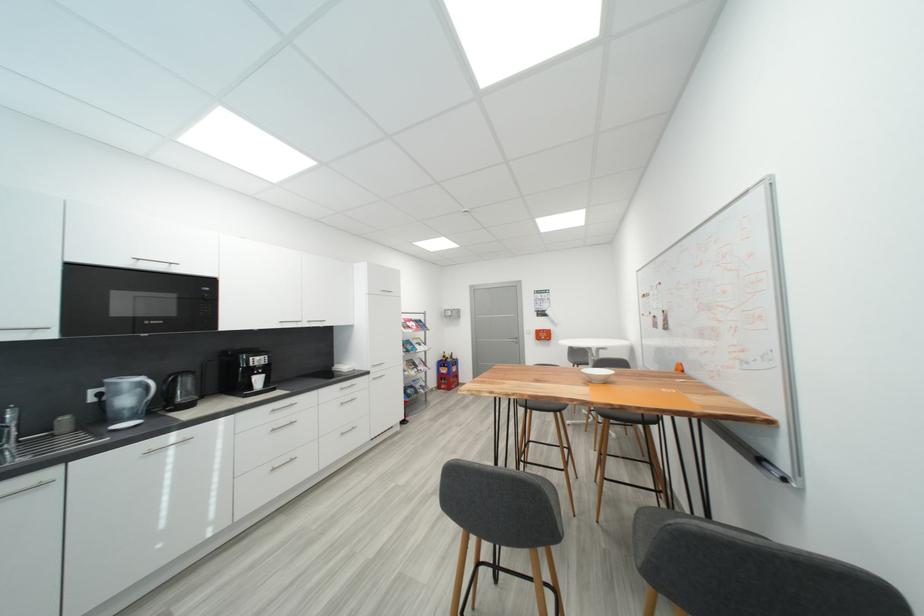
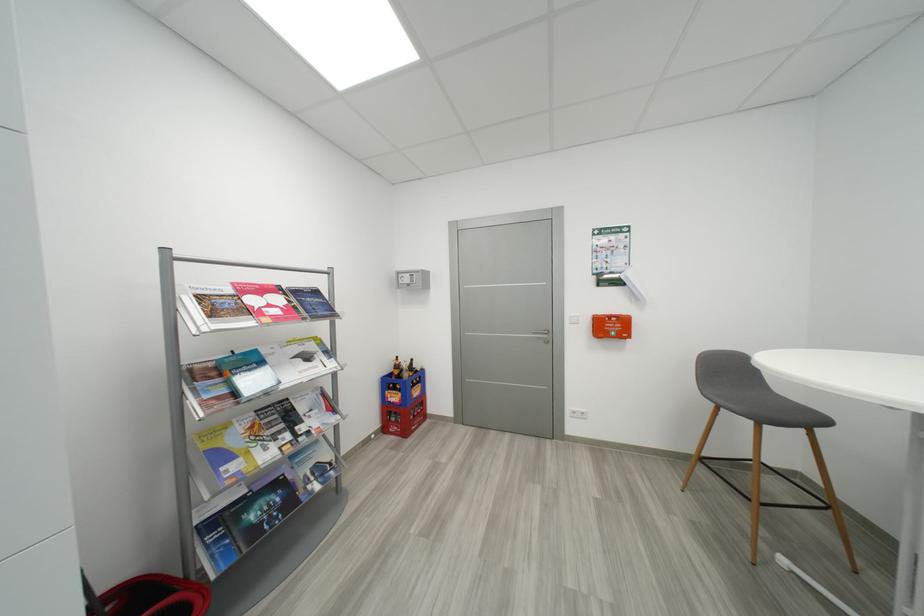
In the second image, find the point that corresponds to [452,359] in the first image.

(404, 369)